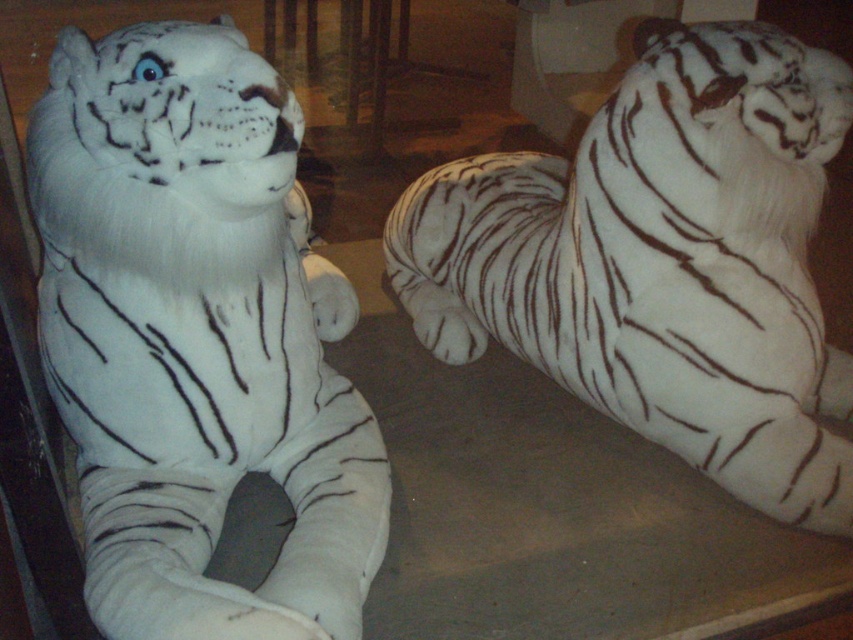
Question: Is white plush tiger at left in front of white plush tiger at right?

Choices:
 (A) yes
 (B) no

Answer: (A)

Question: Which point appears farthest from the camera in this image?

Choices:
 (A) (200, 112)
 (B) (701, 324)

Answer: (B)

Question: Can you confirm if white plush tiger at left is positioned above white plush tiger at right?

Choices:
 (A) yes
 (B) no

Answer: (B)

Question: Can you confirm if white plush tiger at left is bigger than white plush tiger at right?

Choices:
 (A) no
 (B) yes

Answer: (A)

Question: Which point appears farthest from the camera in this image?

Choices:
 (A) (846, 362)
 (B) (221, 435)

Answer: (A)